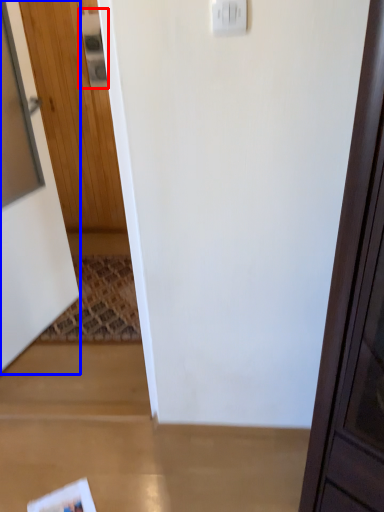
Question: Among these objects, which one is nearest to the camera, light switch (highlighted by a red box) or door (highlighted by a blue box)?

Choices:
 (A) light switch
 (B) door

Answer: (B)